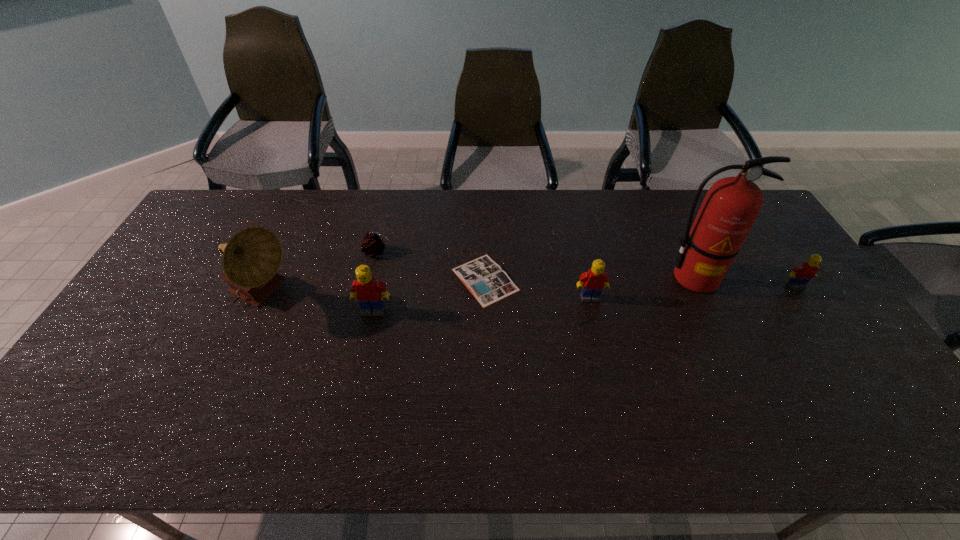
At what (x,y) coordinates should I click in order to perform the action: click on Lego that is the third closest to the sixth shortest object. Please return your answer as a coordinate pair (x, y). This screenshot has width=960, height=540. Looking at the image, I should click on (801, 274).

You are a GUI agent. You are given a task and a screenshot of the screen. Output one action in this format:
    pyautogui.click(x=<x>, y=<y>)
    Task: Click on the Lego that is the second closest one to the book
    This screenshot has height=540, width=960.
    Given the screenshot: What is the action you would take?
    pyautogui.click(x=368, y=290)

Where is `vacant space that satisfies the following two spatial constraints: 1. on the side of the fire extinguisher with the nozzle and handle; 2. on the horn of the leftmost object`? The height and width of the screenshot is (540, 960). vacant space that satisfies the following two spatial constraints: 1. on the side of the fire extinguisher with the nozzle and handle; 2. on the horn of the leftmost object is located at coordinates (704, 297).